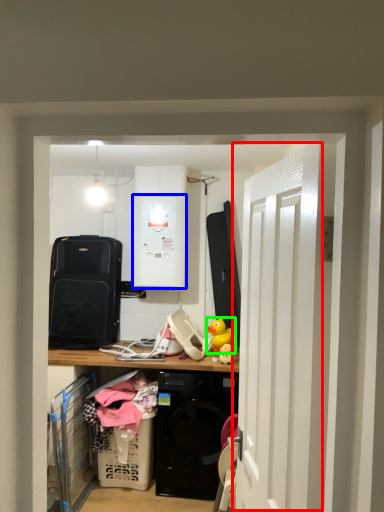
Question: Which object is the closest to the door (highlighted by a red box)? Choose among these: appliance (highlighted by a blue box) or toy (highlighted by a green box).

Choices:
 (A) appliance
 (B) toy

Answer: (B)